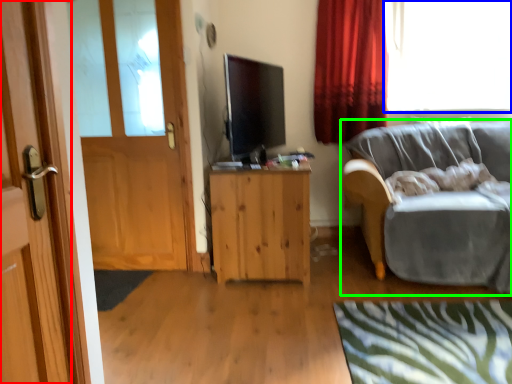
Question: Estimate the real-world distances between objects in this image. Which object is closer to door (highlighted by a red box), window (highlighted by a blue box) or studio couch (highlighted by a green box)?

Choices:
 (A) window
 (B) studio couch

Answer: (B)